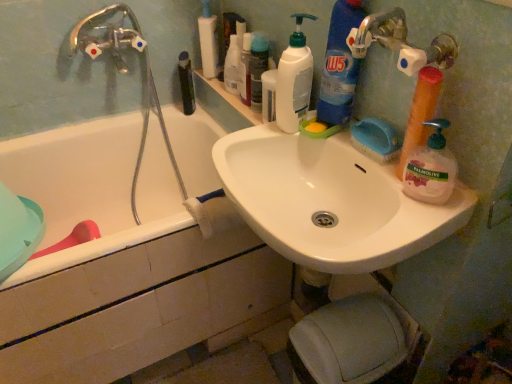
What do you see at coordinates (294, 79) in the screenshot?
I see `white plastic bottle at upper center, which ranks as the first cleaning product in left-to-right order` at bounding box center [294, 79].

Where is `white plastic pump bottle at upper center, the first toiletry from the left`? This screenshot has width=512, height=384. white plastic pump bottle at upper center, the first toiletry from the left is located at coordinates (208, 41).

Identify the location of white ceramic bathtub at left. (93, 188).

Locate an element on the screen. Image resolution: width=512 pixels, height=384 pixels. palmolive liquid soap at right, which appears as the fourth cleaning product when viewed from the left is located at coordinates (431, 168).

From the image's perspective, which is below, white plastic pump bottle at upper center, the 3th toiletry viewed from the right, or palmolive liquid soap at right, the first cleaning product viewed from the right?

palmolive liquid soap at right, the first cleaning product viewed from the right, is shown below in the image.

Is white plastic pump bottle at upper center, the first toiletry from the left, far from palmolive liquid soap at right, the first cleaning product viewed from the right?

No, there isn't a large distance between white plastic pump bottle at upper center, the first toiletry from the left, and palmolive liquid soap at right, the first cleaning product viewed from the right.

From their relative heights in the image, would you say white plastic pump bottle at upper center, the 3th toiletry viewed from the right, is taller or shorter than palmolive liquid soap at right, which appears as the fourth cleaning product when viewed from the left?

Considering their sizes, white plastic pump bottle at upper center, the 3th toiletry viewed from the right, has more height than palmolive liquid soap at right, which appears as the fourth cleaning product when viewed from the left.

Is white plastic pump bottle at upper center, the 3th toiletry viewed from the right, facing towards palmolive liquid soap at right, the first cleaning product viewed from the right?

No, white plastic pump bottle at upper center, the 3th toiletry viewed from the right, is not facing towards palmolive liquid soap at right, the first cleaning product viewed from the right.

Is translucent plastic soap dispenser at upper center, the second toiletry from the right, bigger or smaller than white ceramic bathtub at left?

translucent plastic soap dispenser at upper center, the second toiletry from the right, is smaller than white ceramic bathtub at left.

At what (x,y) coordinates should I click in order to perform the action: click on toiletry that is the 1st one above the white ceramic bathtub at left (from a real-world perspective). Please return your answer as a coordinate pair (x, y). Image resolution: width=512 pixels, height=384 pixels. Looking at the image, I should click on (233, 66).

Which of these two, translucent plastic soap dispenser at upper center, positioned as the second toiletry in left-to-right order, or white ceramic bathtub at left, stands shorter?

translucent plastic soap dispenser at upper center, positioned as the second toiletry in left-to-right order, is shorter.

Between translucent plastic soap dispenser at upper center, the second toiletry from the right, and white ceramic bathtub at left, which one has smaller width?

With smaller width is translucent plastic soap dispenser at upper center, the second toiletry from the right.

From the image's perspective, relative to translucent orange sponge at right, placed as the second cleaning product when sorted from right to left, is translucent plastic soap dispenser at upper center, the second toiletry from the right, above or below?

translucent plastic soap dispenser at upper center, the second toiletry from the right, is situated higher than translucent orange sponge at right, placed as the second cleaning product when sorted from right to left, in the image.

Based on their positions, is translucent plastic soap dispenser at upper center, positioned as the second toiletry in left-to-right order, located to the left or right of translucent orange sponge at right, placed as the second cleaning product when sorted from right to left?

In the image, translucent plastic soap dispenser at upper center, positioned as the second toiletry in left-to-right order, appears on the left side of translucent orange sponge at right, placed as the second cleaning product when sorted from right to left.

How much distance is there between translucent plastic soap dispenser at upper center, positioned as the second toiletry in left-to-right order, and translucent orange sponge at right, which is the third cleaning product from left to right?

A distance of 68.06 centimeters exists between translucent plastic soap dispenser at upper center, positioned as the second toiletry in left-to-right order, and translucent orange sponge at right, which is the third cleaning product from left to right.

What's the angular difference between translucent plastic soap dispenser at upper center, the second toiletry from the right, and translucent orange sponge at right, which is the third cleaning product from left to right,'s facing directions?

The angular difference between translucent plastic soap dispenser at upper center, the second toiletry from the right, and translucent orange sponge at right, which is the third cleaning product from left to right, is 62 degrees.

From the image's perspective, is white plastic pump bottle at upper center, the 3th toiletry viewed from the right, on top of blue glossy detergent at upper right, positioned as the 2th cleaning product in left-to-right order?

Yes, from the image's perspective, white plastic pump bottle at upper center, the 3th toiletry viewed from the right, is over blue glossy detergent at upper right, positioned as the 2th cleaning product in left-to-right order.

Is white plastic pump bottle at upper center, the first toiletry from the left, facing towards blue glossy detergent at upper right, positioned as the 2th cleaning product in left-to-right order?

No, white plastic pump bottle at upper center, the first toiletry from the left, is not oriented towards blue glossy detergent at upper right, positioned as the 2th cleaning product in left-to-right order.

In terms of width, does white plastic pump bottle at upper center, the 3th toiletry viewed from the right, look wider or thinner when compared to blue glossy detergent at upper right, positioned as the 2th cleaning product in left-to-right order?

Clearly, white plastic pump bottle at upper center, the 3th toiletry viewed from the right, has more width compared to blue glossy detergent at upper right, positioned as the 2th cleaning product in left-to-right order.

Considering the sizes of objects white plastic pump bottle at upper center, the 3th toiletry viewed from the right, and blue glossy detergent at upper right, which ranks as the third cleaning product in right-to-left order, in the image provided, who is bigger, white plastic pump bottle at upper center, the 3th toiletry viewed from the right, or blue glossy detergent at upper right, which ranks as the third cleaning product in right-to-left order,?

blue glossy detergent at upper right, which ranks as the third cleaning product in right-to-left order, is bigger.

Is white glossy sink at upper center at the right side of palmolive liquid soap at right, the first cleaning product viewed from the right?

In fact, white glossy sink at upper center is to the left of palmolive liquid soap at right, the first cleaning product viewed from the right.

In the image, is white glossy sink at upper center positioned in front of or behind palmolive liquid soap at right, which appears as the fourth cleaning product when viewed from the left?

Clearly, white glossy sink at upper center is in front of palmolive liquid soap at right, which appears as the fourth cleaning product when viewed from the left.

Consider the image. From a real-world perspective, is white glossy sink at upper center positioned above or below palmolive liquid soap at right, the first cleaning product viewed from the right?

Clearly, from a real-world perspective, white glossy sink at upper center is below palmolive liquid soap at right, the first cleaning product viewed from the right.

Looking at this image, from a real-world perspective, which is physically below, white ceramic bathtub at left or translucent plastic soap dispenser at upper center, the second toiletry from the right?

In real-world perspective, white ceramic bathtub at left is lower.

Is white ceramic bathtub at left positioned beyond the bounds of translucent plastic soap dispenser at upper center, the second toiletry from the right?

Yes.

Which object is further away from the camera taking this photo, white ceramic bathtub at left or translucent plastic soap dispenser at upper center, the second toiletry from the right?

Positioned behind is translucent plastic soap dispenser at upper center, the second toiletry from the right.

What's the angular difference between white ceramic bathtub at left and translucent plastic soap dispenser at upper center, positioned as the second toiletry in left-to-right order,'s facing directions?

The angle between the facing direction of white ceramic bathtub at left and the facing direction of translucent plastic soap dispenser at upper center, positioned as the second toiletry in left-to-right order, is 63.5 degrees.

Find the location of a particular element. cleaning product that is the 3rd one when counting backward from the palmolive liquid soap at right, which appears as the fourth cleaning product when viewed from the left is located at coordinates (294, 79).

Could you tell me if palmolive liquid soap at right, the first cleaning product viewed from the right, is facing white plastic bottle at upper center, which is the 4th cleaning product in right-to-left order?

No.

How many degrees apart are the facing directions of palmolive liquid soap at right, the first cleaning product viewed from the right, and white plastic bottle at upper center, which ranks as the first cleaning product in left-to-right order?

85.7 degrees.

Is palmolive liquid soap at right, the first cleaning product viewed from the right, not near white plastic bottle at upper center, which ranks as the first cleaning product in left-to-right order?

No, there isn't a large distance between palmolive liquid soap at right, the first cleaning product viewed from the right, and white plastic bottle at upper center, which ranks as the first cleaning product in left-to-right order.

Find the location of `the 4th cleaning product counting from the right of the white plastic pump bottle at upper center, the 3th toiletry viewed from the right`. the 4th cleaning product counting from the right of the white plastic pump bottle at upper center, the 3th toiletry viewed from the right is located at coordinates (431, 168).

What are the coordinates of `the 1st toiletry above the white ceramic bathtub at left (from a real-world perspective)` in the screenshot? It's located at (233, 66).

From the image, which object appears to be farther from green matte bottle at upper center, translucent plastic soap dispenser at upper center, positioned as the second toiletry in left-to-right order, or translucent plastic bottle at upper center, the third toiletry in the left-to-right sequence?

translucent plastic bottle at upper center, the third toiletry in the left-to-right sequence.

Looking at the image, which one is located closer to white plastic pump bottle at upper center, the 3th toiletry viewed from the right, white plastic bottle at upper center, which ranks as the first cleaning product in left-to-right order, or translucent plastic soap dispenser at upper center, the second toiletry from the right?

translucent plastic soap dispenser at upper center, the second toiletry from the right, lies closer to white plastic pump bottle at upper center, the 3th toiletry viewed from the right, than the other object.

Considering their positions, is translucent plastic bottle at upper center, the third toiletry in the left-to-right sequence, positioned closer to white glossy sink at upper center than translucent orange sponge at right, placed as the second cleaning product when sorted from right to left?

The object closer to white glossy sink at upper center is translucent orange sponge at right, placed as the second cleaning product when sorted from right to left.

Based on the photo, from the image, which object appears to be farther from green matte bottle at upper center, white ceramic bathtub at left or white glossy sink at upper center?

white glossy sink at upper center is further to green matte bottle at upper center.

Which object lies further to the anchor point white plastic bottle at upper center, which is the 4th cleaning product in right-to-left order, palmolive liquid soap at right, which appears as the fourth cleaning product when viewed from the left, or white glossy sink at upper center?

palmolive liquid soap at right, which appears as the fourth cleaning product when viewed from the left, is further to white plastic bottle at upper center, which is the 4th cleaning product in right-to-left order.

Based on their spatial positions, is white plastic bottle at upper center, which is the 4th cleaning product in right-to-left order, or palmolive liquid soap at right, the first cleaning product viewed from the right, further from white plastic pump bottle at upper center, the 3th toiletry viewed from the right?

Among the two, palmolive liquid soap at right, the first cleaning product viewed from the right, is located further to white plastic pump bottle at upper center, the 3th toiletry viewed from the right.

From the image, which object appears to be nearer to white plastic pump bottle at upper center, the first toiletry from the left, white ceramic bathtub at left or translucent plastic bottle at upper center, the first toiletry positioned from the right?

translucent plastic bottle at upper center, the first toiletry positioned from the right, lies closer to white plastic pump bottle at upper center, the first toiletry from the left, than the other object.

When comparing their distances from white glossy sink at upper center, does translucent plastic soap dispenser at upper center, positioned as the second toiletry in left-to-right order, or translucent orange sponge at right, which is the third cleaning product from left to right, seem further?

Among the two, translucent plastic soap dispenser at upper center, positioned as the second toiletry in left-to-right order, is located further to white glossy sink at upper center.

The height and width of the screenshot is (384, 512). I want to click on cleaning product between white ceramic bathtub at left and blue glossy detergent at upper right, which ranks as the third cleaning product in right-to-left order, so 294,79.

Image resolution: width=512 pixels, height=384 pixels. I want to click on sink between white ceramic bathtub at left and blue glossy detergent at upper right, which ranks as the third cleaning product in right-to-left order, in the horizontal direction, so click(x=334, y=197).

This screenshot has height=384, width=512. Find the location of `cleaning product between blue glossy detergent at upper right, which ranks as the third cleaning product in right-to-left order, and white plastic pump bottle at upper center, the 3th toiletry viewed from the right, along the z-axis`. cleaning product between blue glossy detergent at upper right, which ranks as the third cleaning product in right-to-left order, and white plastic pump bottle at upper center, the 3th toiletry viewed from the right, along the z-axis is located at coordinates click(294, 79).

You are a GUI agent. You are given a task and a screenshot of the screen. Output one action in this format:
    pyautogui.click(x=<x>, y=<y>)
    Task: Click on the toiletry between translucent orange sponge at right, placed as the second cleaning product when sorted from right to left, and translucent plastic soap dispenser at upper center, positioned as the second toiletry in left-to-right order, along the z-axis
    This screenshot has height=384, width=512.
    Given the screenshot: What is the action you would take?
    point(258,66)